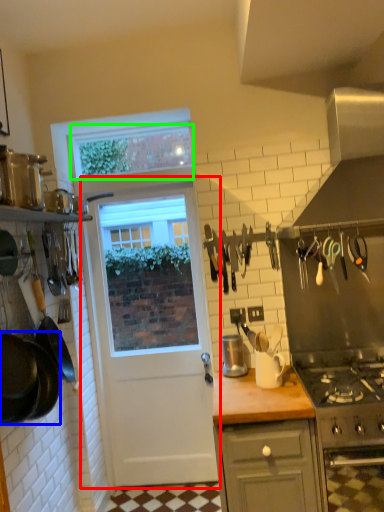
Question: Based on their relative distances, which object is nearer to door (highlighted by a red box)? Choose from frying pan (highlighted by a blue box) and window screen (highlighted by a green box).

Choices:
 (A) frying pan
 (B) window screen

Answer: (B)